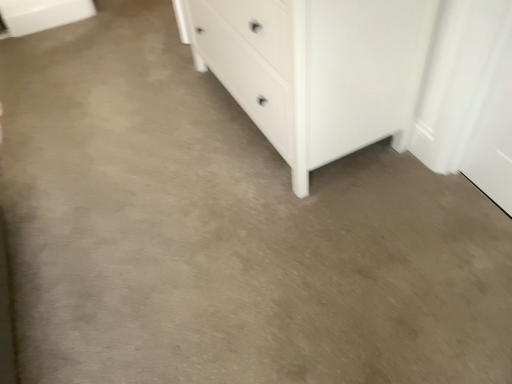
Question: Considering the relative positions of white matte cabinet at upper left and white matte chest of drawers at center in the image provided, is white matte cabinet at upper left to the left or to the right of white matte chest of drawers at center?

Choices:
 (A) right
 (B) left

Answer: (B)

Question: From the image's perspective, is white matte cabinet at upper left above or below white matte chest of drawers at center?

Choices:
 (A) below
 (B) above

Answer: (B)

Question: Looking at the image, does white matte cabinet at upper left seem bigger or smaller compared to white matte chest of drawers at center?

Choices:
 (A) big
 (B) small

Answer: (B)

Question: Based on their positions, is white matte chest of drawers at center located to the left or right of white matte cabinet at upper left?

Choices:
 (A) right
 (B) left

Answer: (A)

Question: From the image's perspective, is white matte chest of drawers at center positioned above or below white matte cabinet at upper left?

Choices:
 (A) above
 (B) below

Answer: (B)

Question: Would you say white matte chest of drawers at center is inside or outside white matte cabinet at upper left?

Choices:
 (A) outside
 (B) inside

Answer: (A)

Question: Does point (334, 29) appear closer or farther from the camera than point (26, 23)?

Choices:
 (A) farther
 (B) closer

Answer: (B)